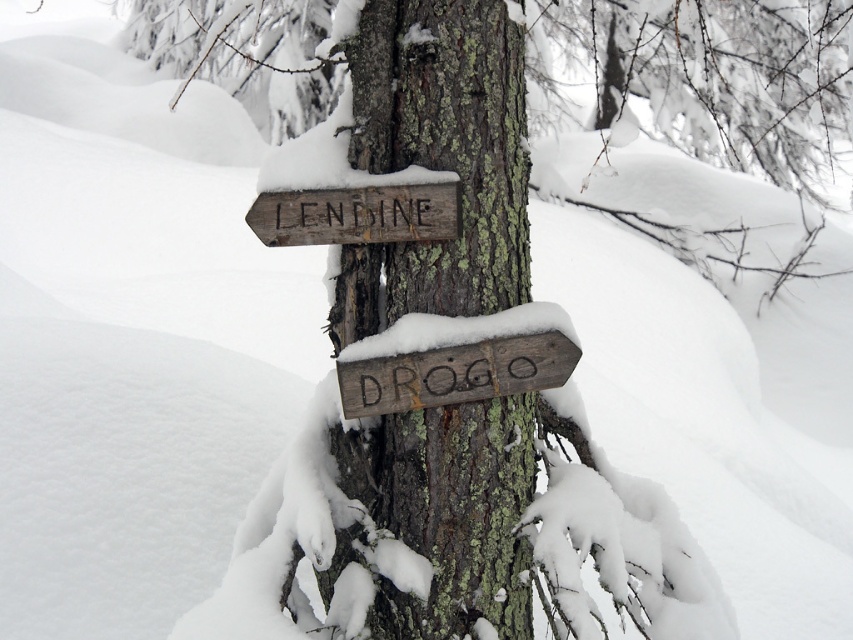
Can you confirm if rough bark tree trunk at center is thinner than weathered wood sign at center?

In fact, rough bark tree trunk at center might be wider than weathered wood sign at center.

Can you confirm if rough bark tree trunk at center is positioned to the left of weathered wood sign at center?

Answer: Indeed, rough bark tree trunk at center is positioned on the left side of weathered wood sign at center.

Is point (482, 188) in front of point (347, 413)?

No.

The height and width of the screenshot is (640, 853). In order to click on rough bark tree trunk at center in this screenshot , I will do `click(438, 157)`.

Can you confirm if weathered wood sign at center is thinner than weathered wood sign at upper center?

No, weathered wood sign at center is not thinner than weathered wood sign at upper center.

Can you confirm if weathered wood sign at center is positioned to the right of weathered wood sign at upper center?

Yes, weathered wood sign at center is to the right of weathered wood sign at upper center.

Where is `weathered wood sign at center`? weathered wood sign at center is located at coordinates (456, 372).

Which is behind, point (360, 118) or point (384, 198)?

The point (360, 118) is more distant.

Does point (393, 17) lie in front of point (265, 230)?

No.

Find the location of a particular element. rough bark tree trunk at center is located at coordinates (438, 157).